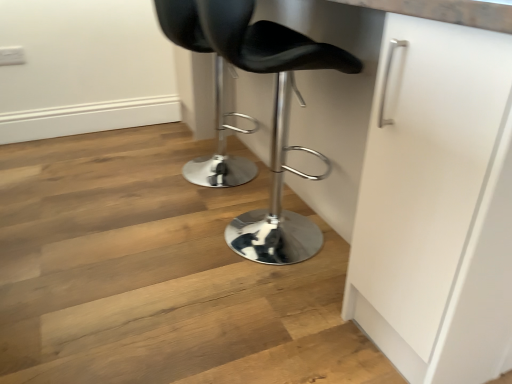
Question: From the image's perspective, is black leather stool at center, which is counted as the 2th chair, starting from the back, above black leather stool at center, the first chair when ordered from back to front?

Choices:
 (A) no
 (B) yes

Answer: (A)

Question: Could black leather stool at center, the 2th chair positioned from the front, be considered to be inside black leather stool at center, the first chair in the front-to-back sequence?

Choices:
 (A) no
 (B) yes

Answer: (A)

Question: Is the position of black leather stool at center, which is counted as the 2th chair, starting from the back, less distant than that of black leather stool at center, the first chair when ordered from back to front?

Choices:
 (A) yes
 (B) no

Answer: (A)

Question: Considering the relative sizes of black leather stool at center, which is counted as the 2th chair, starting from the back, and black leather stool at center, the 2th chair positioned from the front, in the image provided, is black leather stool at center, which is counted as the 2th chair, starting from the back, taller than black leather stool at center, the 2th chair positioned from the front,?

Choices:
 (A) no
 (B) yes

Answer: (B)

Question: Is black leather stool at center, which is counted as the 2th chair, starting from the back, aimed at black leather stool at center, the 2th chair positioned from the front?

Choices:
 (A) no
 (B) yes

Answer: (A)

Question: From a real-world perspective, is black leather stool at center, the first chair in the front-to-back sequence, physically below black leather stool at center, the first chair when ordered from back to front?

Choices:
 (A) no
 (B) yes

Answer: (A)

Question: From a real-world perspective, is black leather stool at center, the 2th chair positioned from the front, positioned over black leather stool at center, the first chair in the front-to-back sequence, based on gravity?

Choices:
 (A) no
 (B) yes

Answer: (A)

Question: From a real-world perspective, is black leather stool at center, the 2th chair positioned from the front, physically below black leather stool at center, which is counted as the 2th chair, starting from the back?

Choices:
 (A) no
 (B) yes

Answer: (B)

Question: Is the position of black leather stool at center, the 2th chair positioned from the front, more distant than that of black leather stool at center, which is counted as the 2th chair, starting from the back?

Choices:
 (A) yes
 (B) no

Answer: (A)

Question: Is black leather stool at center, the first chair when ordered from back to front, not near black leather stool at center, which is counted as the 2th chair, starting from the back?

Choices:
 (A) no
 (B) yes

Answer: (A)

Question: Is black leather stool at center, the first chair when ordered from back to front, wider than black leather stool at center, the first chair in the front-to-back sequence?

Choices:
 (A) no
 (B) yes

Answer: (A)

Question: Is black leather stool at center, the first chair when ordered from back to front, outside of black leather stool at center, which is counted as the 2th chair, starting from the back?

Choices:
 (A) no
 (B) yes

Answer: (B)

Question: Visually, is black leather stool at center, the first chair when ordered from back to front, positioned to the left or to the right of black leather stool at center, the first chair in the front-to-back sequence?

Choices:
 (A) left
 (B) right

Answer: (A)